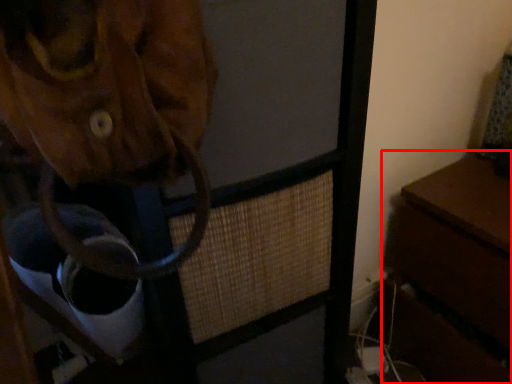
Question: From the image's perspective, what is the correct spatial positioning of table (annotated by the red box) in reference to furniture?

Choices:
 (A) above
 (B) below

Answer: (B)